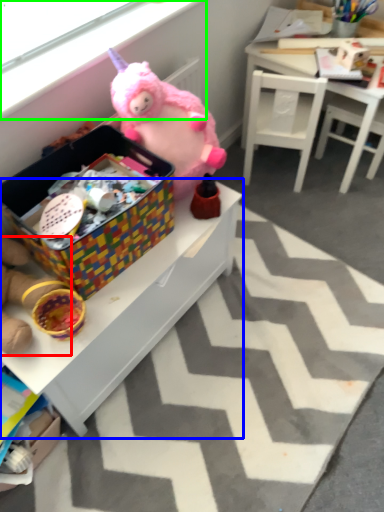
Question: Which object is positioned closest to toy (highlighted by a red box)? Select from table (highlighted by a blue box) and window screen (highlighted by a green box).

Choices:
 (A) table
 (B) window screen

Answer: (A)